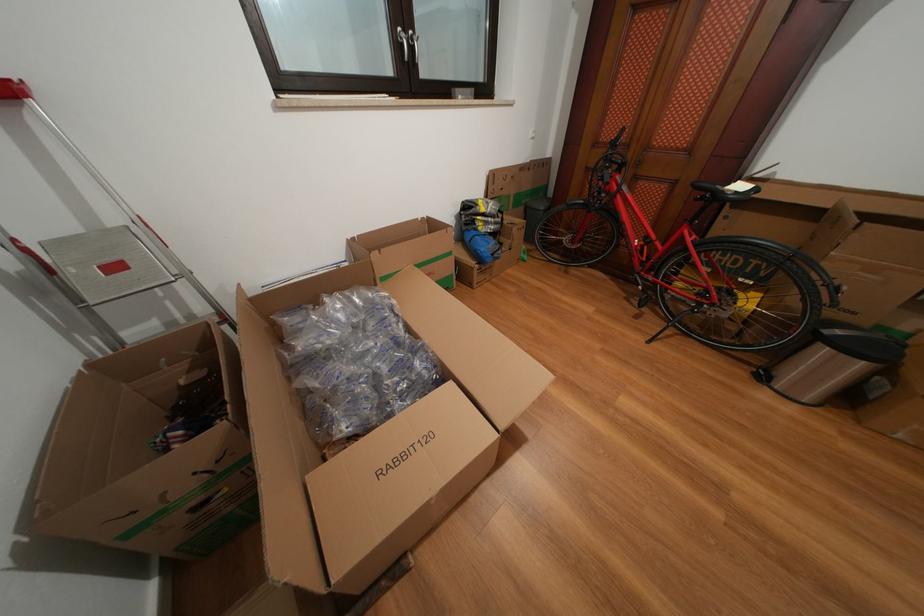
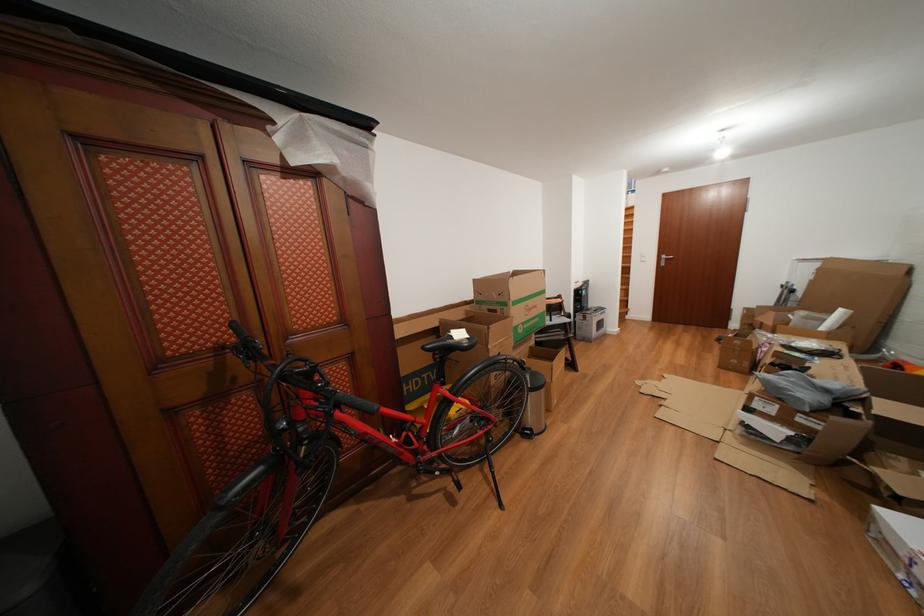
Where in the second image is the point corresponding to point (747, 192) from the first image?

(468, 339)